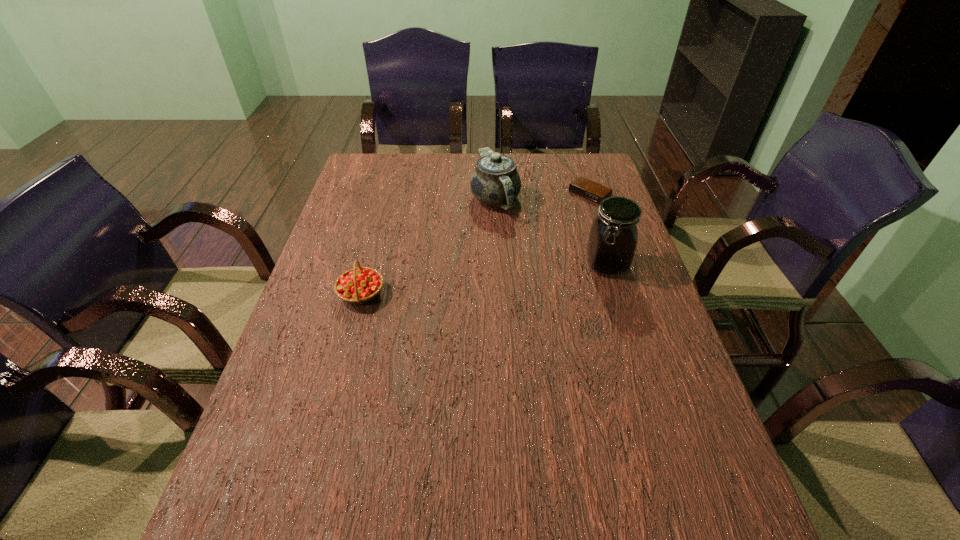
Where is `free spot between the third object from right to left and the alarm clock`? The height and width of the screenshot is (540, 960). free spot between the third object from right to left and the alarm clock is located at coordinates (542, 197).

Where is `free space between the jar and the strawberry`? The width and height of the screenshot is (960, 540). free space between the jar and the strawberry is located at coordinates (484, 279).

Locate an element on the screen. Image resolution: width=960 pixels, height=540 pixels. unoccupied position between the jar and the leftmost object is located at coordinates pos(484,279).

Identify the location of vacant area that lies between the alarm clock and the chinaware. [542, 197].

The image size is (960, 540). I want to click on free space between the jar and the strawberry, so click(x=484, y=279).

Where is `object that is the third closest to the third object from right to left`? Image resolution: width=960 pixels, height=540 pixels. object that is the third closest to the third object from right to left is located at coordinates (361, 285).

Identify the location of object that ranks as the second closest to the jar. (583, 187).